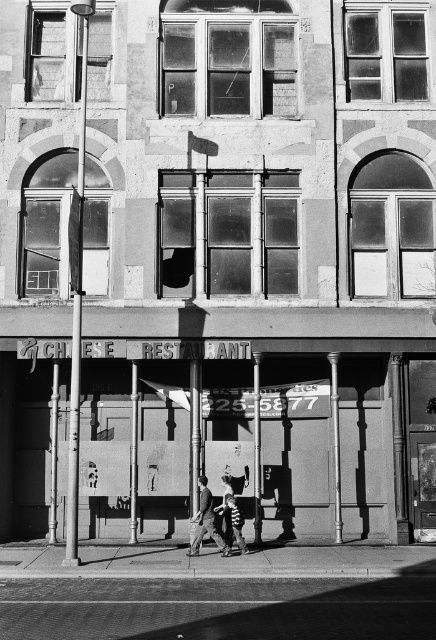
You are standing at the entrance of the Chinese restaurant and want to walk to the smooth asphalt road at bottom. Which direction should you move in?

The smooth asphalt road at bottom is located at point (218, 609), so you should move downward from the entrance to reach it.

You are standing on the smooth concrete sidewalk at lower center and want to enter the Chinese Restaurant. Which direction should you walk to reach the smooth concrete storefront at center?

Since the smooth concrete storefront at center is to the left of the smooth concrete sidewalk at lower center, you should walk to your left to reach it.